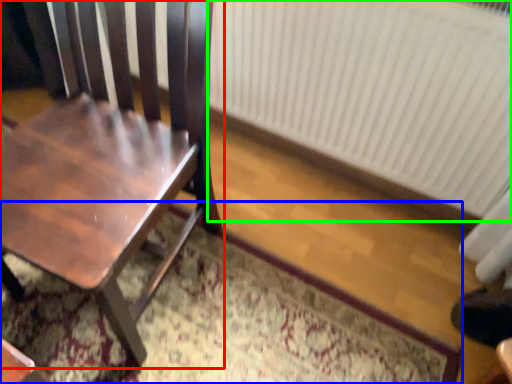
Question: Which object is the closest to the chair (highlighted by a red box)? Choose among these: doormat (highlighted by a blue box) or radiator (highlighted by a green box).

Choices:
 (A) doormat
 (B) radiator

Answer: (A)